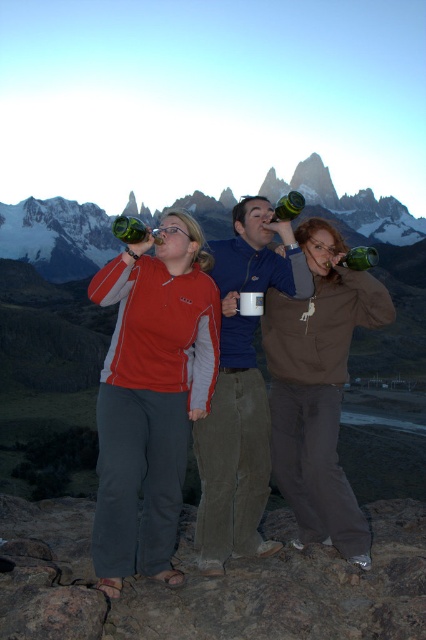
Is point (284, 385) behind point (284, 220)?

No, (284, 385) is closer to viewer.

Between point (313, 368) and point (281, 208), which one is positioned in front?

Point (313, 368)

Image resolution: width=426 pixels, height=640 pixels. Describe the element at coordinates (317, 388) in the screenshot. I see `matte brown jacket at center` at that location.

The height and width of the screenshot is (640, 426). I want to click on matte brown jacket at center, so click(317, 388).

Does matte red jacket at center have a lesser height compared to green glass bottle at center?

No, matte red jacket at center is not shorter than green glass bottle at center.

Who is positioned more to the left, matte red jacket at center or green glass bottle at center?

green glass bottle at center

Between point (172, 358) and point (120, 216), which one is positioned behind?

The point (172, 358) is more distant.

In order to click on matte red jacket at center in this screenshot , I will do `click(150, 396)`.

Does blue fleece jacket at center have a lesser height compared to green plastic bottle at upper center?

In fact, blue fleece jacket at center may be taller than green plastic bottle at upper center.

Is blue fleece jacket at center further to the viewer compared to green plastic bottle at upper center?

That is False.

You are a GUI agent. You are given a task and a screenshot of the screen. Output one action in this format:
    pyautogui.click(x=<x>, y=<y>)
    Task: Click on the blue fleece jacket at center
    This screenshot has width=426, height=640.
    Given the screenshot: What is the action you would take?
    pyautogui.click(x=241, y=388)

You are a GUI agent. You are given a task and a screenshot of the screen. Output one action in this format:
    pyautogui.click(x=<x>, y=<y>)
    Task: Click on the blue fleece jacket at center
    
    Given the screenshot: What is the action you would take?
    pyautogui.click(x=241, y=388)